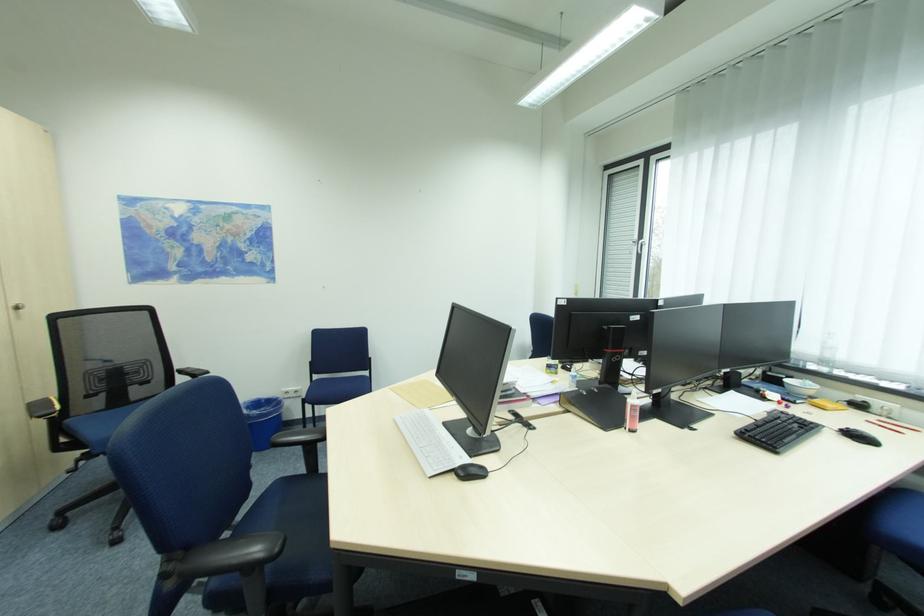
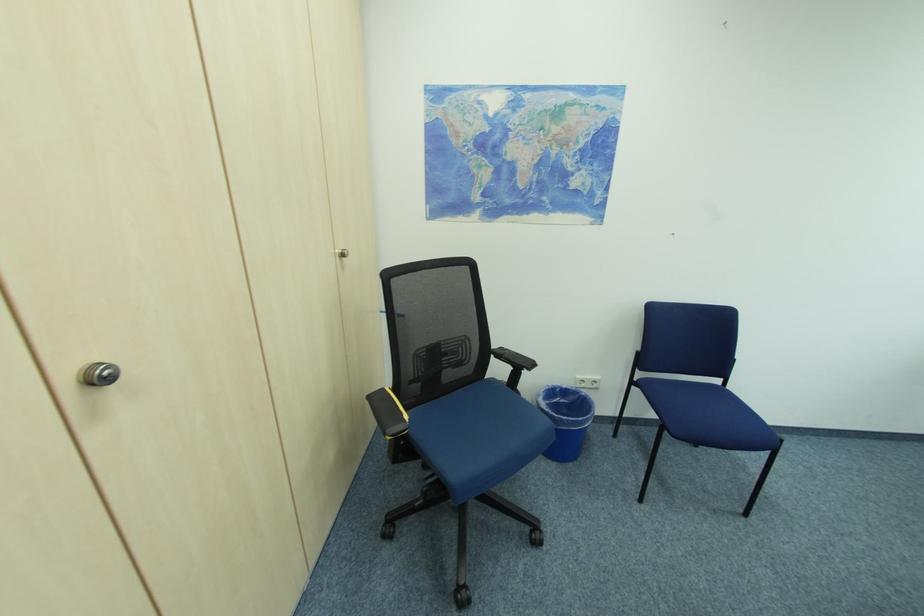
Which direction would the cameraman need to move to produce the second image?

The cameraman moved toward left, forward.